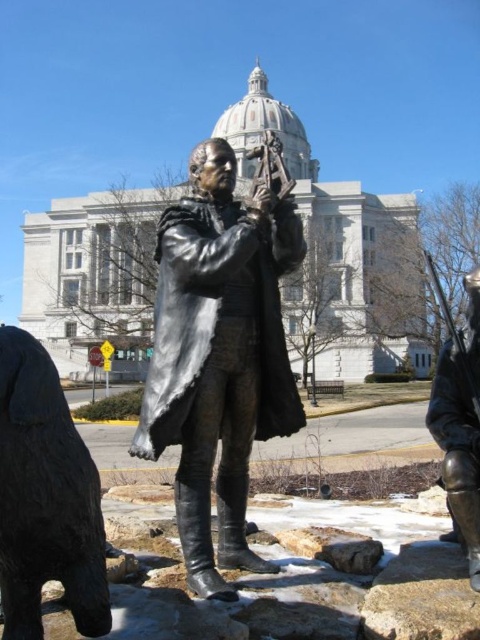
You are standing at the camera position and want to place a 100 feet long banner in front of the bronze statue at center. Can the banner be placed without overlapping the statue?

The bronze statue at center is 45.49 feet from camera. Since the banner is 100 feet long, it can be placed in front of the statue without overlapping as the distance is sufficient.

You are a tour guide explaining the statue and its surroundings. A visitor asks if there is a bear near the statue. Where is the black polished bear at lower left in relation to the statue?

The black polished bear at lower left is located at point (46,497) relative to the statue.

You are an art student analyzing the composition of the image. You notice the bronze statue at center and the black polished bear at lower left. Which object is positioned to the east if the statue faces north?

The bronze statue at center is to the right of the black polished bear at lower left. Since the statue faces north, its right side would be eastward. Therefore, the black polished bear at lower left is positioned to the west of the bronze statue at center, meaning the bronze statue at center is to the east of the black polished bear at lower left.